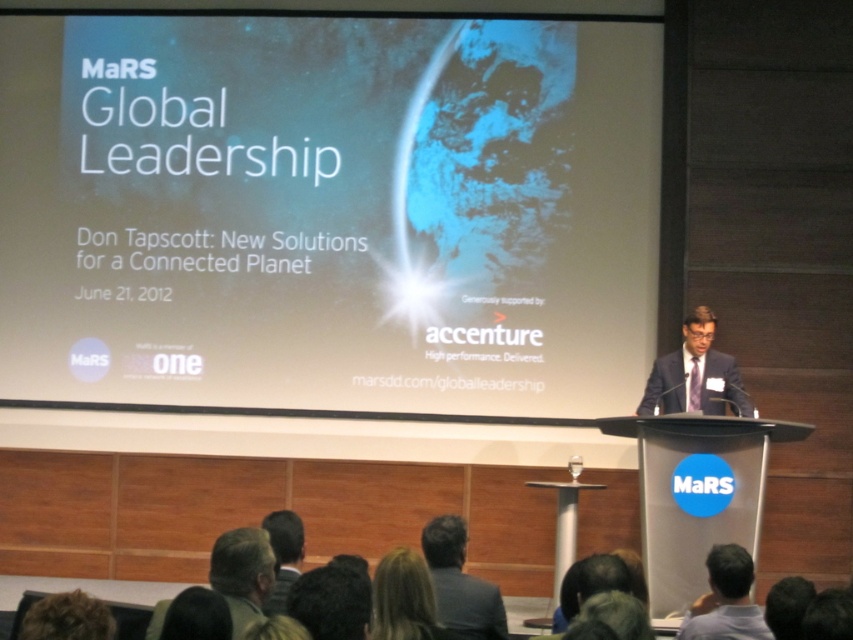
You are sitting in the front row of the conference hall and want to look at both the dark blue suit at center and the white matte projection screen at upper center. Which object will you need to tilt your head upwards more to see?

The white matte projection screen at upper center is further to the viewer than the dark blue suit at center, so you will need to tilt your head upwards more to see the dark blue suit at center.

Based on the scene description, where is the white matte projection screen at upper center located in the image?

The white matte projection screen at upper center is located at point 0.333 on the x axis and 0.387 on the y axis.

You are a photographer taking a picture of the presentation. You notice two points in the image at coordinates point (669, 355) and point (94, 618). Which point is closer to the camera?

Point (94, 618) is closer to the camera than point (669, 355).